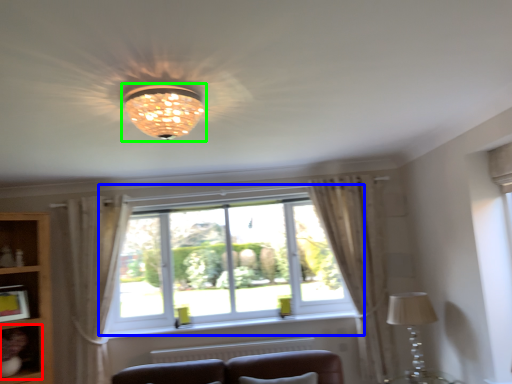
Question: Based on their relative distances, which object is farther from shelf (highlighted by a red box)? Choose from window (highlighted by a blue box) and lamp (highlighted by a green box).

Choices:
 (A) window
 (B) lamp

Answer: (B)